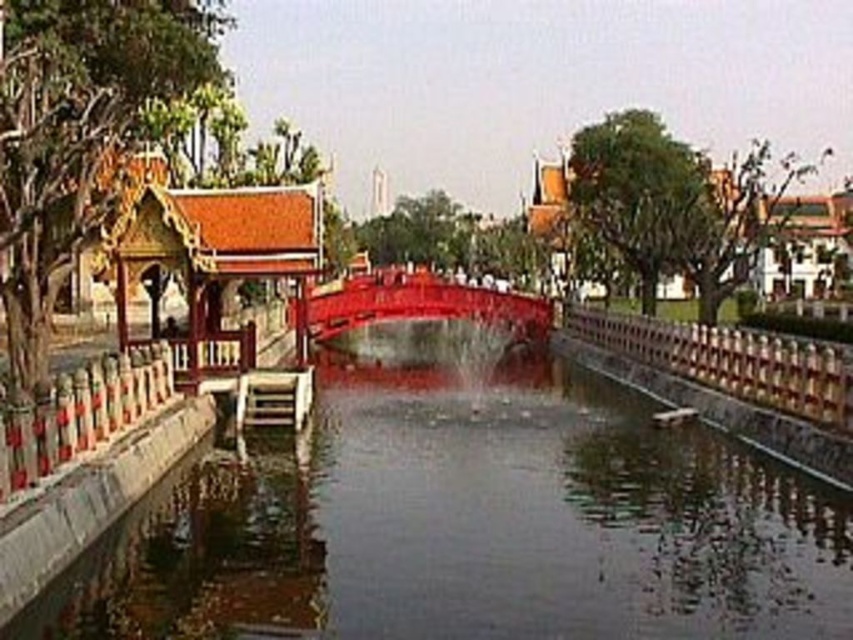
You are a tourist standing at the entrance of the pavilion on the left. You want to cross to the other side of the waterway. The bridge you see is the glossy wood bridge at center. However, there is also a smooth concrete river at center. Which object should you use to cross the waterway safely?

You should use the glossy wood bridge at center to cross the waterway safely because the smooth concrete river at center is a body of water and not a structure for crossing. The glossy wood bridge at center is designed for safe passage over the water.

You are standing at the edge of the scene and want to cross to the other side. The smooth concrete river at center is in your way. Can you jump over it?

The smooth concrete river at center is 9.98 meters away from the viewer, so it is not possible to jump over it as the distance is too great for a typical human jump.

You are standing at the point with coordinates (463, 516) in the image. What is located at this point?

The point at coordinates (463, 516) is occupied by the smooth concrete river at center.